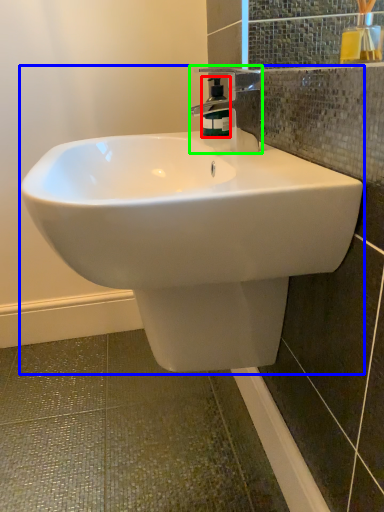
Question: Which object is positioned closest to soap dispenser (highlighted by a red box)? Select from sink (highlighted by a blue box) and tap (highlighted by a green box).

Choices:
 (A) sink
 (B) tap

Answer: (B)